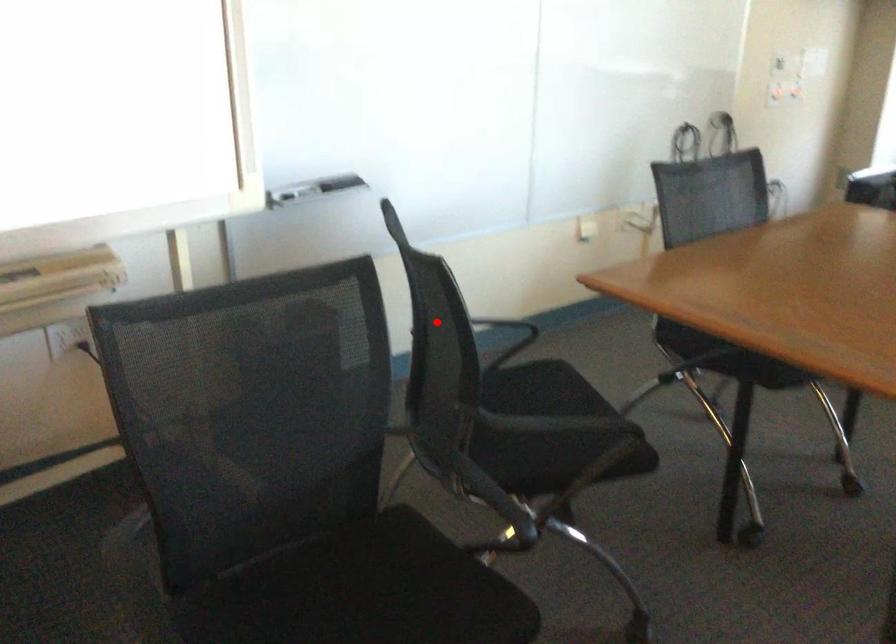
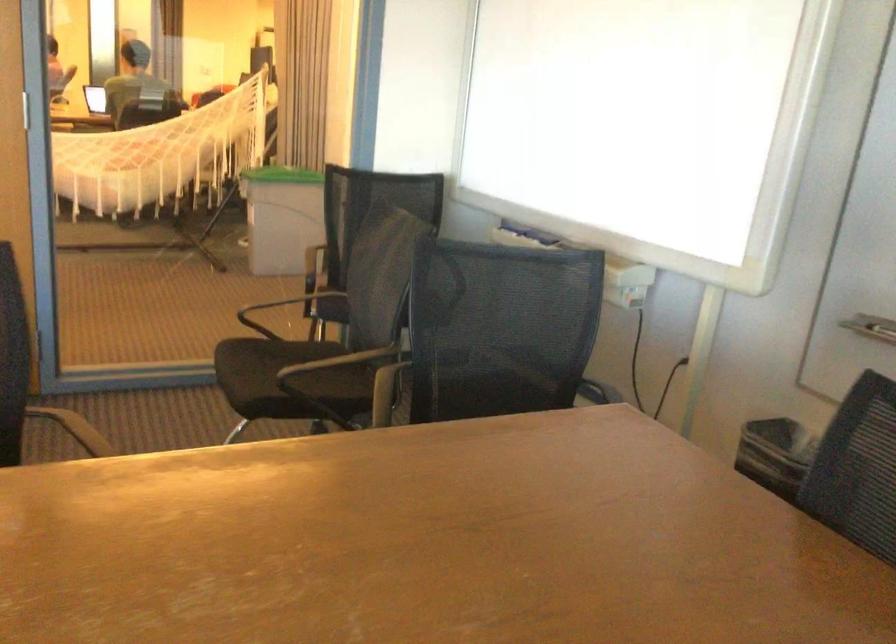
Question: I am providing you with two images of the same scene from different viewpoints. In image1, a red point is highlighted. Considering the same 3D point in image2, which of the following is correct?

Choices:
 (A) It is closer
 (B) It is farther

Answer: (B)